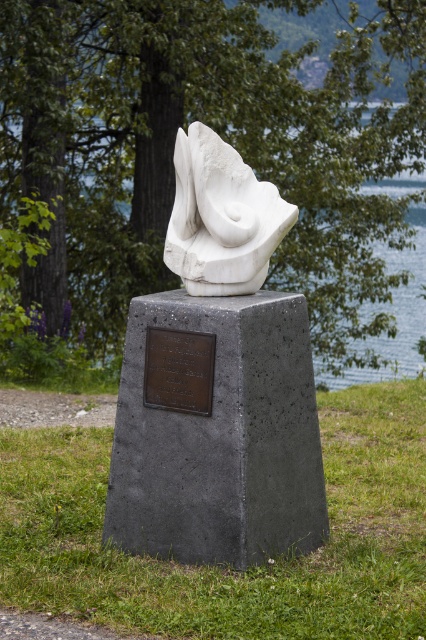
Question: Which of these objects is positioned farthest from the white marble bust at center?

Choices:
 (A) blue water at center
 (B) gray concrete pedestal at center

Answer: (A)

Question: Does white marble bust at center come behind blue water at center?

Choices:
 (A) no
 (B) yes

Answer: (A)

Question: Based on their relative distances, which object is nearer to the gray concrete pedestal at center?

Choices:
 (A) white marble bust at center
 (B) bronze plaque at center
 (C) blue water at center

Answer: (B)

Question: Which of the following is the farthest from the observer?

Choices:
 (A) coord(389,268)
 (B) coord(184,131)
 (C) coord(169,332)

Answer: (A)

Question: Does gray concrete pedestal at center appear on the left side of bronze plaque at center?

Choices:
 (A) yes
 (B) no

Answer: (B)

Question: Is gray concrete pedestal at center closer to the viewer compared to bronze plaque at center?

Choices:
 (A) yes
 (B) no

Answer: (A)